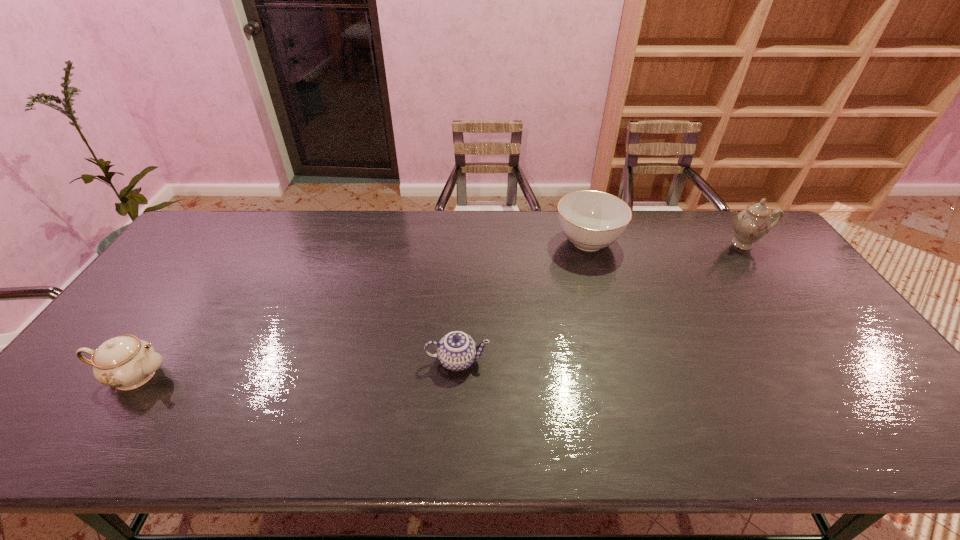
Image resolution: width=960 pixels, height=540 pixels. Identify the location of free space between the leftmost chinaware and the third object from left to right. (361, 308).

At what (x,y) coordinates should I click in order to perform the action: click on vacant area between the second chinaware from right to left and the rightmost chinaware. Please return your answer as a coordinate pair (x, y). This screenshot has width=960, height=540. Looking at the image, I should click on (665, 243).

Locate an element on the screen. free space between the tallest object and the second chinaware from right to left is located at coordinates (665, 243).

Find the location of a particular element. The image size is (960, 540). free spot between the third object from right to left and the third object from left to right is located at coordinates (523, 301).

Locate an element on the screen. This screenshot has height=540, width=960. free point between the third chinaware from right to left and the third chinaware from left to right is located at coordinates (523, 301).

Find the location of a particular element. unoccupied area between the rightmost chinaware and the shortest object is located at coordinates (600, 302).

This screenshot has height=540, width=960. In order to click on empty location between the third object from left to right and the second chinaware from left to right in this screenshot , I will do `click(523, 301)`.

Choose which object is the nearest neighbor to the leftmost object. Please provide its 2D coordinates. Your answer should be formatted as a tuple, i.e. [(x, y)], where the tuple contains the x and y coordinates of a point satisfying the conditions above.

[(457, 350)]

Locate an element on the screen. the closest object to the third object from left to right is located at coordinates (750, 225).

Where is `chinaware that is the closest one to the second object from right to left`? chinaware that is the closest one to the second object from right to left is located at coordinates coord(750,225).